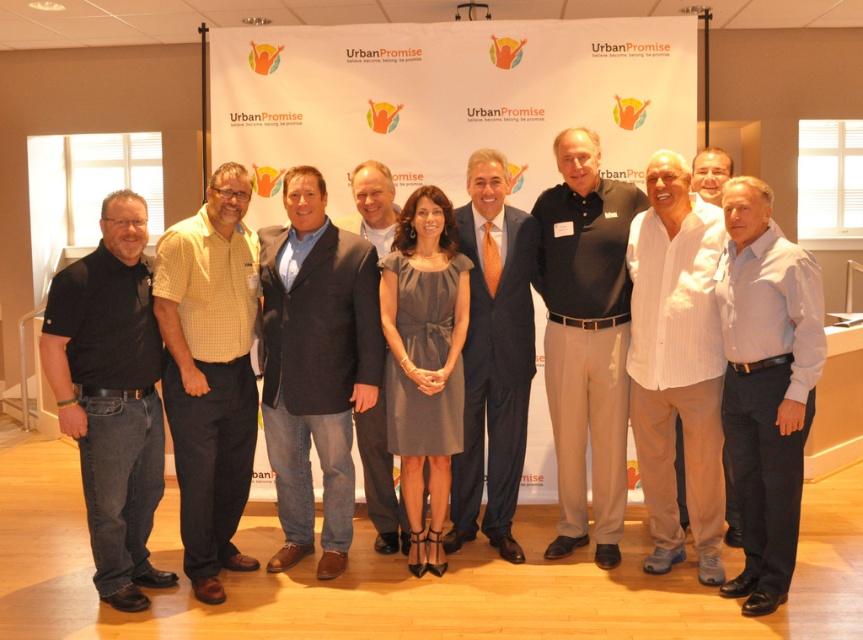
You are standing in front of the UrbanPromise banner and want to take a photo with the group. The photographer tells you to stand exactly where the white striped shirt at center was positioned. What coordinates should you aim for?

You should aim for the coordinates point (676, 364) where the white striped shirt at center was positioned.

You are standing in front of the UrbanPromise banner and notice a point marked at coordinates (111, 396). Which object from the scene is located at this point?

The point at coordinates (111, 396) marks the location of the black cotton shirt at left.

You are a photographer who needs to adjust the camera focus. The white striped shirt at center and the matte navy suit at center are both in the frame. Which one is shorter?

The white striped shirt at center is shorter than the matte navy suit at center.